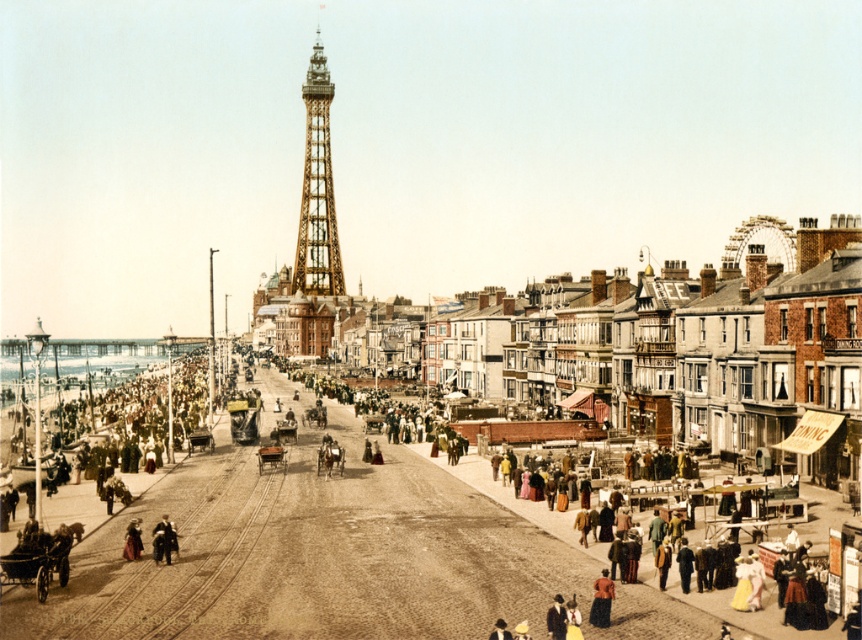
In the scene shown: You are a tourist in this 19th century seaside town and want to take a photo of the golden metallic tower at center and the matte red dress at lower left. Which object should you place on the left side of your camera frame to capture both in the scene?

To capture both the golden metallic tower at center and the matte red dress at lower left in your photo, you should place the golden metallic tower at center on the left side of your camera frame since it is already positioned on the left side of the matte red dress at lower left in the scene.

Based on the photo, you are an architect visiting this historic town and want to take a photo of the golden metallic tower at center and the matte red dress at lower left. Which object should you focus on first if you want to capture both in the same frame without moving the camera?

The golden metallic tower at center is taller than the matte red dress at lower left, so you should focus on the golden metallic tower at center first to ensure it fits entirely in the frame before adjusting for the smaller matte red dress at lower left.